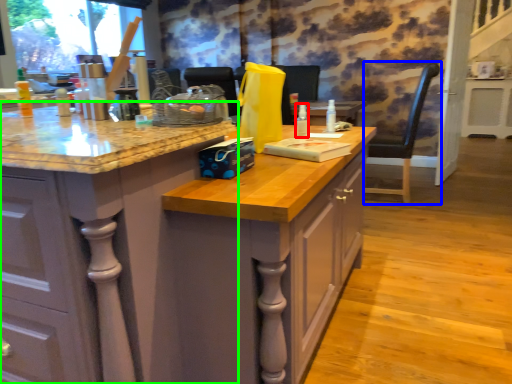
Question: Considering the real-world distances, which object is closest to bottle (highlighted by a red box)? chair (highlighted by a blue box) or cabinetry (highlighted by a green box).

Choices:
 (A) chair
 (B) cabinetry

Answer: (B)